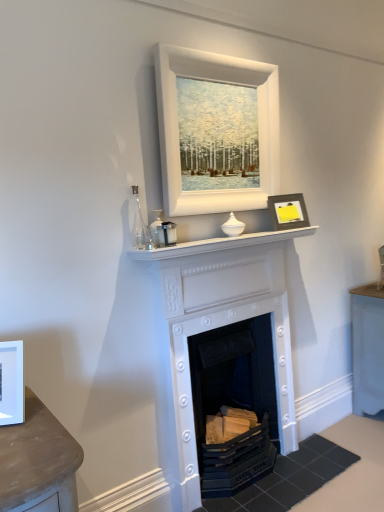
Question: Is white painted fireplace at center, which is the first fireplace in top-to-bottom order, positioned behind white matte picture frame at upper center, marked as the 3th picture frame in a bottom-to-top arrangement?

Choices:
 (A) yes
 (B) no

Answer: (A)

Question: Is white painted fireplace at center, which is the first fireplace in top-to-bottom order, aimed at white matte picture frame at upper center, marked as the second picture frame in a left-to-right arrangement?

Choices:
 (A) no
 (B) yes

Answer: (A)

Question: Does white painted fireplace at center, which is the first fireplace in top-to-bottom order, have a larger size compared to white matte picture frame at upper center, marked as the second picture frame in a left-to-right arrangement?

Choices:
 (A) no
 (B) yes

Answer: (B)

Question: Can we say white painted fireplace at center, placed as the 2th fireplace when sorted from bottom to top, lies outside white matte picture frame at upper center, which appears as the 2th picture frame when viewed from the right?

Choices:
 (A) no
 (B) yes

Answer: (B)

Question: Can you confirm if white painted fireplace at center, placed as the 2th fireplace when sorted from bottom to top, is positioned to the left of white matte picture frame at upper center, which appears as the 2th picture frame when viewed from the right?

Choices:
 (A) yes
 (B) no

Answer: (B)

Question: Considering the relative sizes of white painted fireplace at center, which is the first fireplace in top-to-bottom order, and white matte picture frame at upper center, marked as the 3th picture frame in a bottom-to-top arrangement, in the image provided, is white painted fireplace at center, which is the first fireplace in top-to-bottom order, wider than white matte picture frame at upper center, marked as the 3th picture frame in a bottom-to-top arrangement,?

Choices:
 (A) no
 (B) yes

Answer: (B)

Question: Is white painted wood fireplace at center, placed as the 1th fireplace when sorted from bottom to top, beside white glossy mantle at center?

Choices:
 (A) no
 (B) yes

Answer: (A)

Question: From a real-world perspective, does white painted wood fireplace at center, arranged as the 2th fireplace when viewed from the top, sit lower than white glossy mantle at center?

Choices:
 (A) yes
 (B) no

Answer: (A)

Question: Can you confirm if white painted wood fireplace at center, arranged as the 2th fireplace when viewed from the top, is bigger than white glossy mantle at center?

Choices:
 (A) no
 (B) yes

Answer: (B)

Question: Is white painted wood fireplace at center, arranged as the 2th fireplace when viewed from the top, far from white glossy mantle at center?

Choices:
 (A) yes
 (B) no

Answer: (B)

Question: Is white painted wood fireplace at center, arranged as the 2th fireplace when viewed from the top, to the left of white glossy mantle at center from the viewer's perspective?

Choices:
 (A) yes
 (B) no

Answer: (A)

Question: Is white painted wood fireplace at center, placed as the 1th fireplace when sorted from bottom to top, at the right side of white glossy mantle at center?

Choices:
 (A) yes
 (B) no

Answer: (B)

Question: Could you tell me if white matte picture frame at left, the 1th picture frame in the bottom-to-top sequence, is turned towards white matte picture frame at upper center, placed as the second picture frame when sorted from front to back?

Choices:
 (A) yes
 (B) no

Answer: (B)